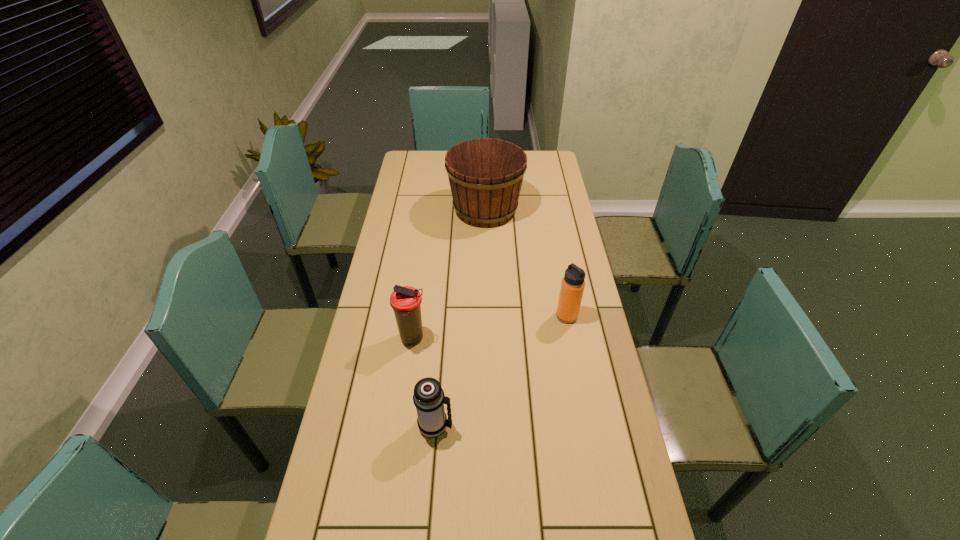
The height and width of the screenshot is (540, 960). Identify the location of the farthest object. (485, 175).

This screenshot has height=540, width=960. Identify the location of the second nearest object. (405, 301).

Where is `the second farthest object`? The image size is (960, 540). the second farthest object is located at coordinates (572, 286).

This screenshot has height=540, width=960. I want to click on the farthest thermos bottle, so click(572, 286).

This screenshot has width=960, height=540. In order to click on the nearest object in this screenshot , I will do `click(429, 399)`.

The image size is (960, 540). I want to click on the shortest object, so click(429, 399).

Where is `free space located on the left of the wine bucket`? free space located on the left of the wine bucket is located at coordinates (393, 210).

Where is `free space located 0.220m on the front of the second nearest object`? free space located 0.220m on the front of the second nearest object is located at coordinates (401, 418).

Identify the location of free space located on the front of the second farthest object. (589, 437).

This screenshot has height=540, width=960. I want to click on vacant space located 0.070m on the side with the handle of the shortest object, so click(x=479, y=426).